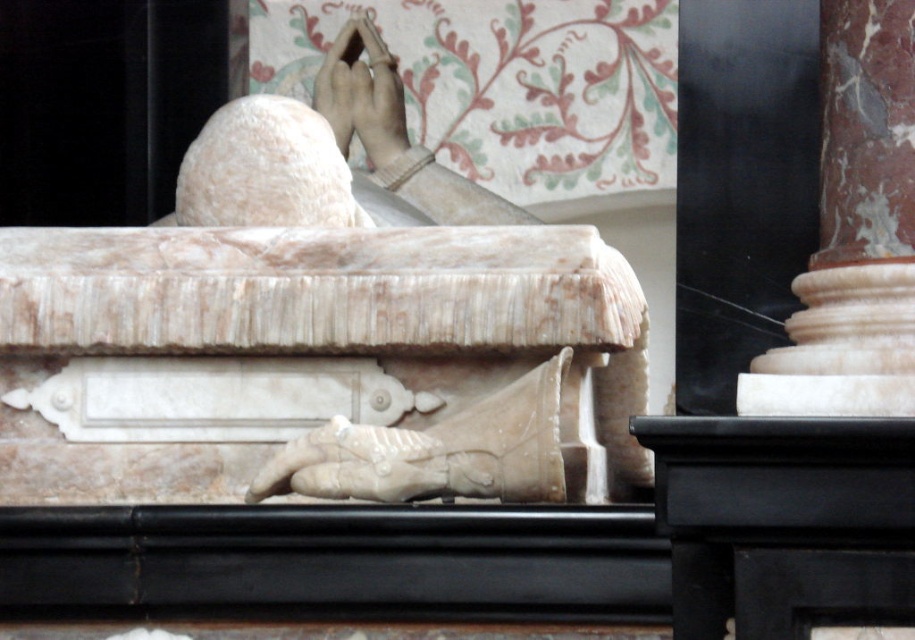
Question: Does white marble statue at center have a lesser width compared to marble column at right?

Choices:
 (A) no
 (B) yes

Answer: (A)

Question: Which of the following is the closest to the observer?

Choices:
 (A) (784, 403)
 (B) (353, 132)
 (C) (192, 168)
 (D) (20, 230)

Answer: (A)

Question: Which of the following is the closest to the observer?

Choices:
 (A) click(x=857, y=337)
 (B) click(x=307, y=212)
 (C) click(x=426, y=394)

Answer: (A)

Question: Which object appears closest to the camera in this image?

Choices:
 (A) white marble statue at center
 (B) white marble skull at upper center
 (C) marble column at right
 (D) matte stone hand at upper center

Answer: (A)

Question: Does marble column at right appear over matte stone hand at upper center?

Choices:
 (A) no
 (B) yes

Answer: (A)

Question: From the image, what is the correct spatial relationship of white marble statue at center in relation to white marble skull at upper center?

Choices:
 (A) above
 (B) below

Answer: (B)